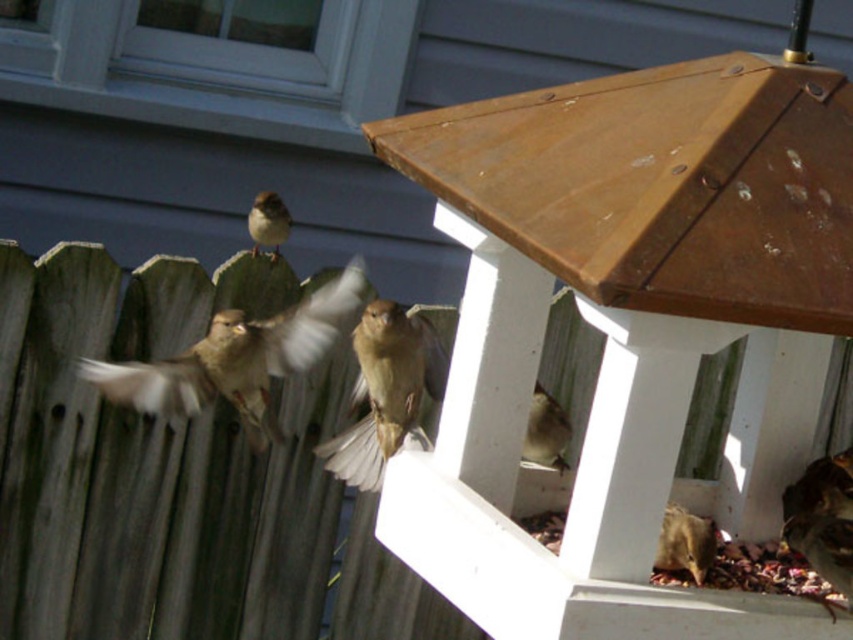
Question: Can you confirm if brown matte sparrow at lower right is bigger than brown matte bird at lower center?

Choices:
 (A) yes
 (B) no

Answer: (B)

Question: Which object is the closest to the brown matte bird at center?

Choices:
 (A) weathered wood fence at left
 (B) brown feathered bird at center
 (C) brown matte sparrow at lower right

Answer: (B)

Question: Is brown feathered bird at center thinner than brown feathered bird at upper center?

Choices:
 (A) no
 (B) yes

Answer: (A)

Question: Which is farther from the brown matte bird at lower center?

Choices:
 (A) brown matte bird at center
 (B) weathered wood fence at left

Answer: (B)

Question: Which object is the farthest from the weathered wood fence at left?

Choices:
 (A) brown matte sparrow at lower right
 (B) brown feathered bird at center
 (C) brown matte bird at center
 (D) brown feathered bird at upper center

Answer: (A)

Question: Is weathered wood fence at left wider than brown feathered bird at center?

Choices:
 (A) no
 (B) yes

Answer: (B)